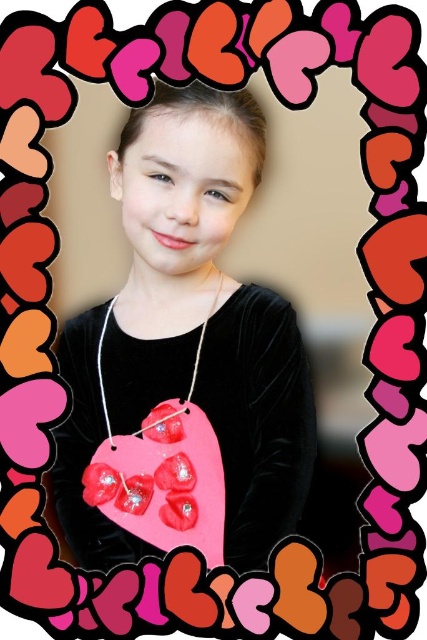
Where is the matte pink heart at center located in the image?

The matte pink heart at center is located at point (189, 332).

You are designing a greeting card and need to know if the matte pink heart at center and the matte velvet heart at center can be placed close enough to touch each other without overlapping. The minimum distance required between them to avoid overlapping is 3 inches. Can they be placed this way?

The distance between the matte pink heart at center and the matte velvet heart at center is 3.74 inches, which is greater than the 3 inches minimum requirement. Therefore, they can be placed close enough to touch without overlapping.